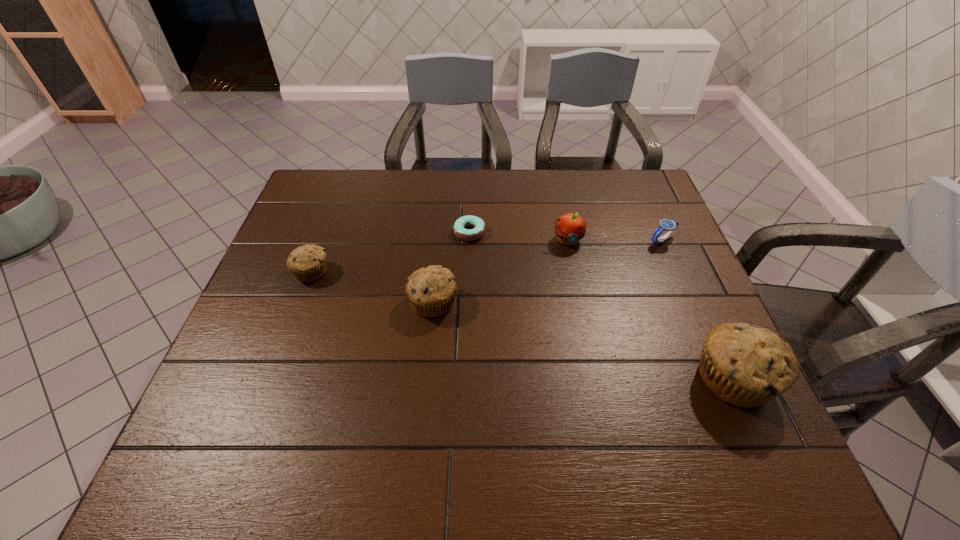
To achieve even spacing by inserting another muffin among them, please point to a vacant spot for this new muffin. Please provide its 2D coordinates. Your answer should be formatted as a tuple, i.e. [(x, y)], where the tuple contains the x and y coordinates of a point satisfying the conditions above.

[(572, 338)]